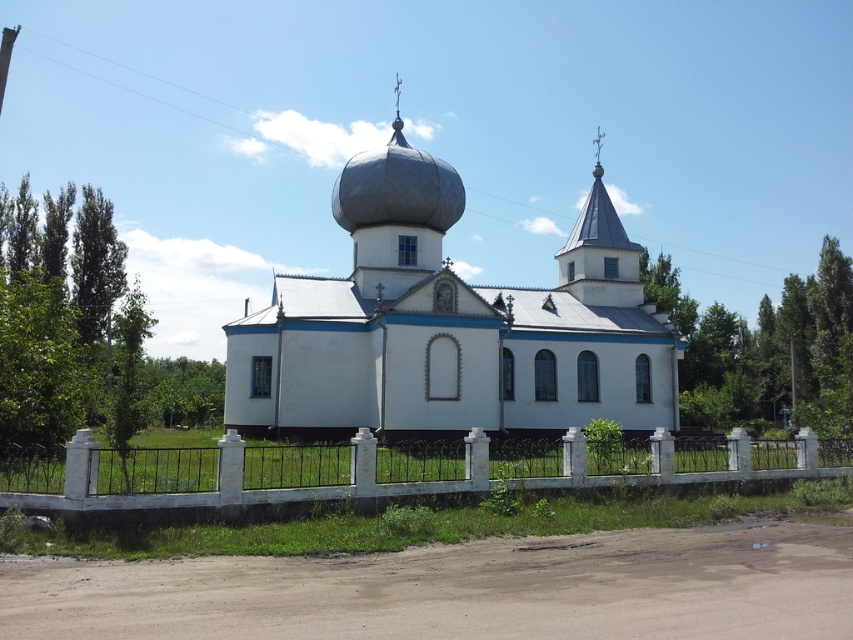
Which of these two, white smooth church at center or white concrete fence at lower center, stands shorter?

white concrete fence at lower center

Consider the image. Does white smooth church at center lie in front of white concrete fence at lower center?

No, it is behind white concrete fence at lower center.

Is point (473, 403) positioned after point (242, 476)?

That is True.

Where is `white smooth church at center`? Image resolution: width=853 pixels, height=640 pixels. white smooth church at center is located at coordinates (450, 324).

Does white concrete fence at lower center appear on the left side of shiny silver dome at center?

No, white concrete fence at lower center is not to the left of shiny silver dome at center.

In the scene shown: Measure the distance from white concrete fence at lower center to shiny silver dome at center.

white concrete fence at lower center and shiny silver dome at center are 24.82 meters apart from each other.

Is point (114, 488) closer to camera compared to point (412, 179)?

Yes, point (114, 488) is in front of point (412, 179).

The image size is (853, 640). Identify the location of white concrete fence at lower center. (238, 477).

Can you confirm if white smooth church at center is positioned below shiny silver dome at center?

Indeed, white smooth church at center is positioned under shiny silver dome at center.

Who is higher up, white smooth church at center or shiny silver dome at center?

shiny silver dome at center is above.

Where is `white smooth church at center`? The width and height of the screenshot is (853, 640). white smooth church at center is located at coordinates (450, 324).